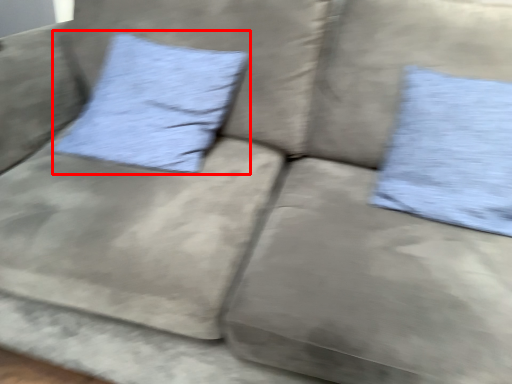
Question: From the image's perspective, considering the relative positions of pillow (annotated by the red box) and pillow in the image provided, where is pillow (annotated by the red box) located with respect to the staircase?

Choices:
 (A) above
 (B) below

Answer: (A)